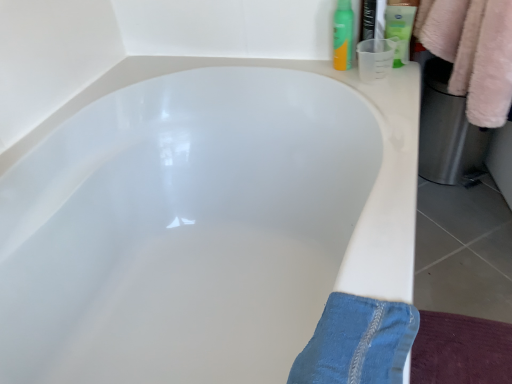
Where is `free spot in front of green matte spray can at upper right, marked as the second toiletry in a right-to-left arrangement`? free spot in front of green matte spray can at upper right, marked as the second toiletry in a right-to-left arrangement is located at coordinates (366, 86).